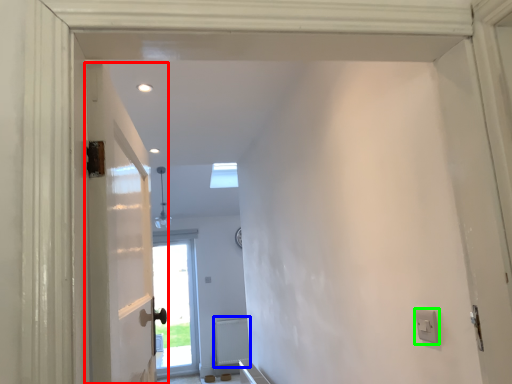
Question: Considering the real-world distances, which object is closest to door (highlighted by a red box)? radiator (highlighted by a blue box) or electric outlet (highlighted by a green box).

Choices:
 (A) radiator
 (B) electric outlet

Answer: (B)